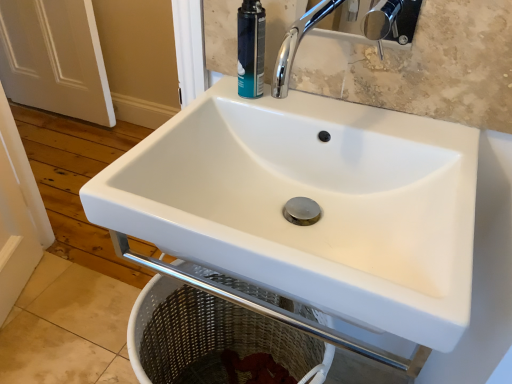
Question: Is white matte door at left further to camera compared to teal matte shaving cream can at upper center?

Choices:
 (A) yes
 (B) no

Answer: (A)

Question: From the image's perspective, is white matte door at left on teal matte shaving cream can at upper center?

Choices:
 (A) yes
 (B) no

Answer: (A)

Question: Considering the relative sizes of white matte door at left and teal matte shaving cream can at upper center in the image provided, is white matte door at left thinner than teal matte shaving cream can at upper center?

Choices:
 (A) no
 (B) yes

Answer: (A)

Question: Considering the relative sizes of white matte door at left and teal matte shaving cream can at upper center in the image provided, is white matte door at left bigger than teal matte shaving cream can at upper center?

Choices:
 (A) yes
 (B) no

Answer: (A)

Question: Considering the relative positions of white matte door at left and teal matte shaving cream can at upper center in the image provided, is white matte door at left to the left of teal matte shaving cream can at upper center from the viewer's perspective?

Choices:
 (A) yes
 (B) no

Answer: (A)

Question: Is white matte door at left wider than teal matte shaving cream can at upper center?

Choices:
 (A) yes
 (B) no

Answer: (A)

Question: Does teal matte shaving cream can at upper center appear on the right side of white ceramic sink at center?

Choices:
 (A) yes
 (B) no

Answer: (B)

Question: Is teal matte shaving cream can at upper center not inside white ceramic sink at center?

Choices:
 (A) yes
 (B) no

Answer: (A)

Question: Is teal matte shaving cream can at upper center placed right next to white ceramic sink at center?

Choices:
 (A) no
 (B) yes

Answer: (A)

Question: Considering the relative positions of teal matte shaving cream can at upper center and white ceramic sink at center in the image provided, is teal matte shaving cream can at upper center in front of white ceramic sink at center?

Choices:
 (A) yes
 (B) no

Answer: (B)

Question: Is teal matte shaving cream can at upper center behind white ceramic sink at center?

Choices:
 (A) yes
 (B) no

Answer: (A)

Question: Is teal matte shaving cream can at upper center oriented towards white ceramic sink at center?

Choices:
 (A) yes
 (B) no

Answer: (B)

Question: Considering the relative sizes of white ceramic sink at center and teal matte shaving cream can at upper center in the image provided, is white ceramic sink at center shorter than teal matte shaving cream can at upper center?

Choices:
 (A) no
 (B) yes

Answer: (A)